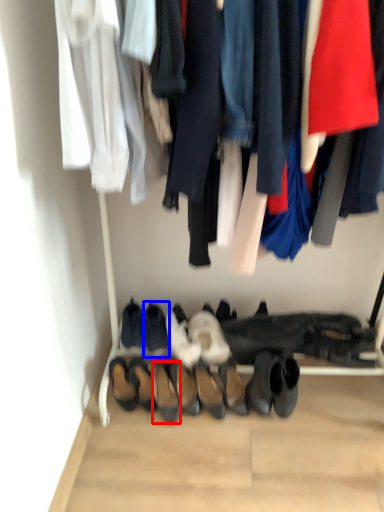
Question: Which of the following is the farthest to the observer, footwear (highlighted by a red box) or footwear (highlighted by a blue box)?

Choices:
 (A) footwear
 (B) footwear

Answer: (B)